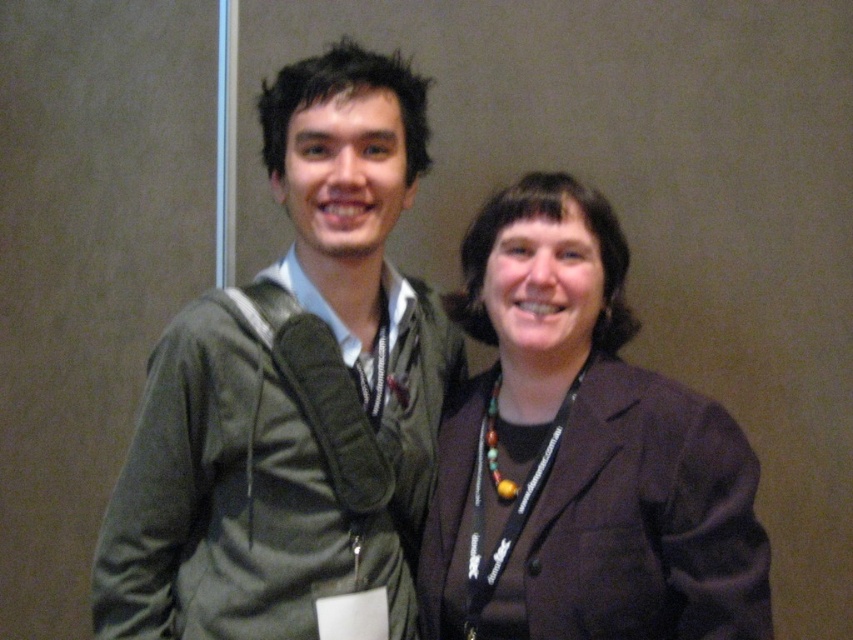
This screenshot has width=853, height=640. Describe the element at coordinates (293, 397) in the screenshot. I see `green fabric jacket at left` at that location.

Between point (383, 211) and point (573, 360), which one is positioned in front?

Point (383, 211) is more forward.

This screenshot has height=640, width=853. What do you see at coordinates (293, 397) in the screenshot? I see `green fabric jacket at left` at bounding box center [293, 397].

Image resolution: width=853 pixels, height=640 pixels. In order to click on green fabric jacket at left in this screenshot , I will do `click(293, 397)`.